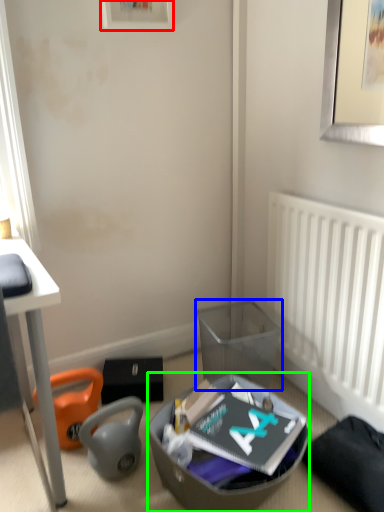
Question: Which object is the closest to the picture frame (highlighted by a red box)? Choose among these: trash bin/can (highlighted by a blue box) or shoe box (highlighted by a green box).

Choices:
 (A) trash bin/can
 (B) shoe box

Answer: (A)